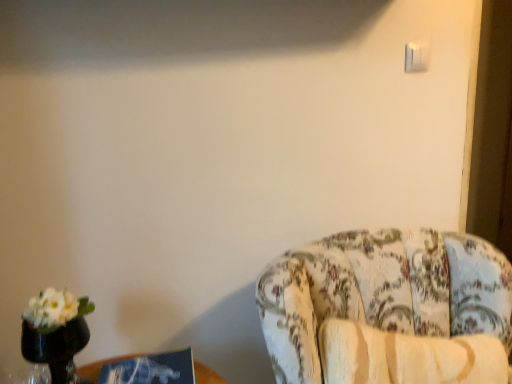
Question: From the image's perspective, is white plastic light switch at upper right on top of blue cardboard box at lower left?

Choices:
 (A) yes
 (B) no

Answer: (A)

Question: Is the position of white plastic light switch at upper right less distant than that of blue cardboard box at lower left?

Choices:
 (A) no
 (B) yes

Answer: (A)

Question: Is white plastic light switch at upper right outside blue cardboard box at lower left?

Choices:
 (A) no
 (B) yes

Answer: (B)

Question: Is white plastic light switch at upper right to the right of blue cardboard box at lower left from the viewer's perspective?

Choices:
 (A) no
 (B) yes

Answer: (B)

Question: Is white plastic light switch at upper right in contact with blue cardboard box at lower left?

Choices:
 (A) no
 (B) yes

Answer: (A)

Question: Is white plastic light switch at upper right surrounding blue cardboard box at lower left?

Choices:
 (A) yes
 (B) no

Answer: (B)

Question: Can you confirm if blue cardboard box at lower left is taller than floral fabric chair at right?

Choices:
 (A) yes
 (B) no

Answer: (B)

Question: Is there a large distance between blue cardboard box at lower left and floral fabric chair at right?

Choices:
 (A) yes
 (B) no

Answer: (B)

Question: Considering the relative positions of blue cardboard box at lower left and floral fabric chair at right in the image provided, is blue cardboard box at lower left in front of floral fabric chair at right?

Choices:
 (A) no
 (B) yes

Answer: (A)

Question: From the image's perspective, is blue cardboard box at lower left located beneath floral fabric chair at right?

Choices:
 (A) yes
 (B) no

Answer: (A)

Question: Can you confirm if blue cardboard box at lower left is positioned to the left of floral fabric chair at right?

Choices:
 (A) yes
 (B) no

Answer: (A)

Question: From a real-world perspective, is blue cardboard box at lower left positioned under floral fabric chair at right based on gravity?

Choices:
 (A) yes
 (B) no

Answer: (B)

Question: Can you confirm if white plastic light switch at upper right is smaller than floral fabric chair at right?

Choices:
 (A) no
 (B) yes

Answer: (B)